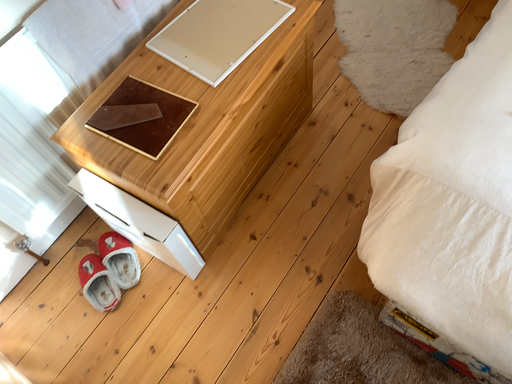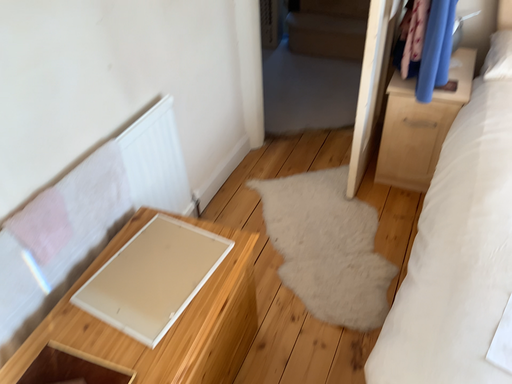
Question: Which way did the camera rotate in the video?

Choices:
 (A) rotated left
 (B) rotated right

Answer: (B)